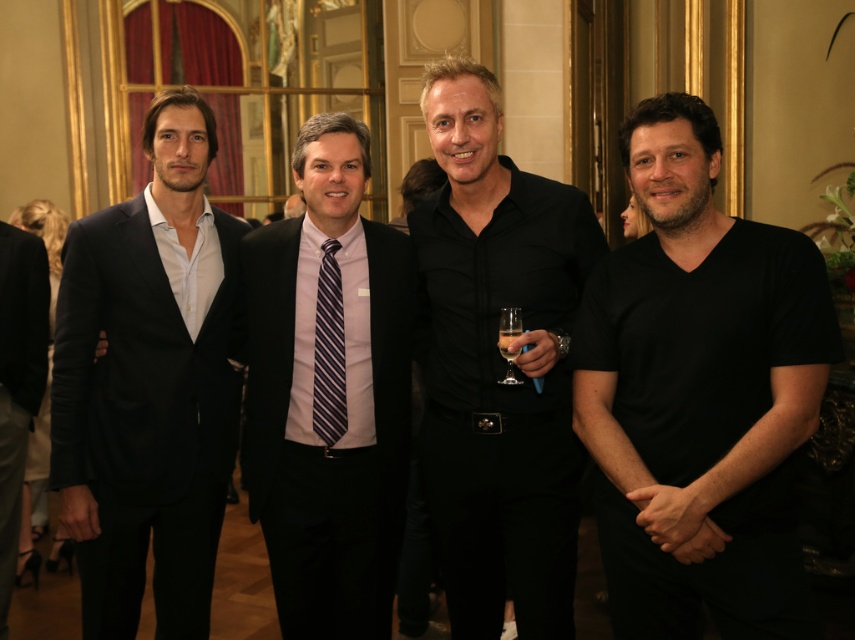
Question: Considering the real-world distances, which object is closest to the matte black suit at left?

Choices:
 (A) clear glass wine glass at center
 (B) black smooth shirt at center
 (C) clear glass at center

Answer: (B)

Question: Is black matte shirt at right in front of clear glass wine glass at center?

Choices:
 (A) yes
 (B) no

Answer: (A)

Question: Which of the following is the closest to the observer?

Choices:
 (A) (90, 634)
 (B) (331, 282)

Answer: (A)

Question: Among these objects, which one is farthest from the camera?

Choices:
 (A) black matte suit at left
 (B) matte black suit at left
 (C) clear glass at center

Answer: (A)

Question: Observing the image, what is the correct spatial positioning of black smooth shirt at center in reference to black matte suit at left?

Choices:
 (A) above
 (B) below

Answer: (A)

Question: Can you confirm if matte black suit at left is smaller than clear glass wine glass at center?

Choices:
 (A) no
 (B) yes

Answer: (A)